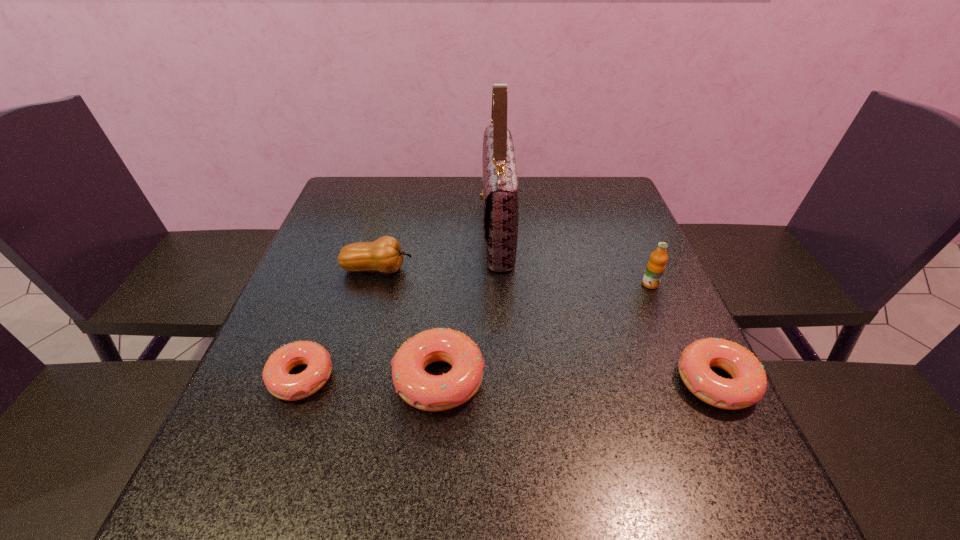
Image resolution: width=960 pixels, height=540 pixels. I want to click on vacant space located on the left of the second tallest doughnut, so click(x=503, y=382).

This screenshot has width=960, height=540. What are the coordinates of `free space located 0.310m on the front of the handbag with the clasp` in the screenshot? It's located at (369, 230).

I want to click on vacant space situated on the front of the handbag with the clasp, so click(x=415, y=230).

Find the location of a particular element. vacant space located 0.250m on the front of the handbag with the clasp is located at coordinates (390, 230).

I want to click on vacant space located on the stem side of the gourd, so point(498,269).

Identify the location of free space located on the label of the orange juice. The image size is (960, 540). (662, 311).

This screenshot has width=960, height=540. Identify the location of object located at the far edge. (500, 198).

Locate an element on the screen. The width and height of the screenshot is (960, 540). doughnut present at the left edge is located at coordinates (281, 384).

The width and height of the screenshot is (960, 540). I want to click on gourd at the left edge, so click(385, 255).

Locate an element on the screen. The height and width of the screenshot is (540, 960). doughnut situated at the right edge is located at coordinates (749, 383).